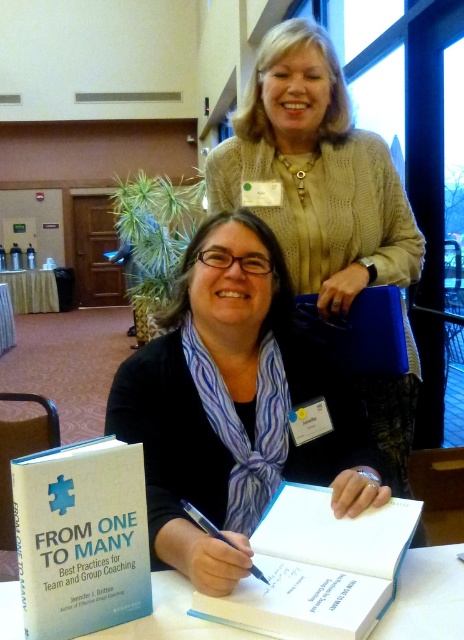
How much distance is there between black matte scarf at center and knitted beige sweater at upper center?

black matte scarf at center is 17.64 inches from knitted beige sweater at upper center.

At what (x,y) coordinates should I click in order to perform the action: click on black matte scarf at center. Please return your answer as a coordinate pair (x, y). Looking at the image, I should click on (233, 404).

Image resolution: width=464 pixels, height=640 pixels. In order to click on black matte scarf at center in this screenshot , I will do `click(233, 404)`.

The height and width of the screenshot is (640, 464). What do you see at coordinates (32, 291) in the screenshot?
I see `white tablecloth at lower left` at bounding box center [32, 291].

Does white tablecloth at lower left appear on the left side of black metallic pen at center?

Correct, you'll find white tablecloth at lower left to the left of black metallic pen at center.

Between point (32, 296) and point (207, 520), which one is positioned in front?

Point (207, 520) is more forward.

This screenshot has height=640, width=464. In order to click on white tablecloth at lower left in this screenshot , I will do `click(32, 291)`.

Does white paper at center have a greater height compared to white tablecloth at lower left?

No.

Is white paper at center thinner than white tablecloth at lower left?

Indeed, white paper at center has a lesser width compared to white tablecloth at lower left.

Is point (171, 637) closer to viewer compared to point (14, 304)?

Yes, point (171, 637) is in front of point (14, 304).

The width and height of the screenshot is (464, 640). In order to click on white paper at center in this screenshot , I will do `click(426, 596)`.